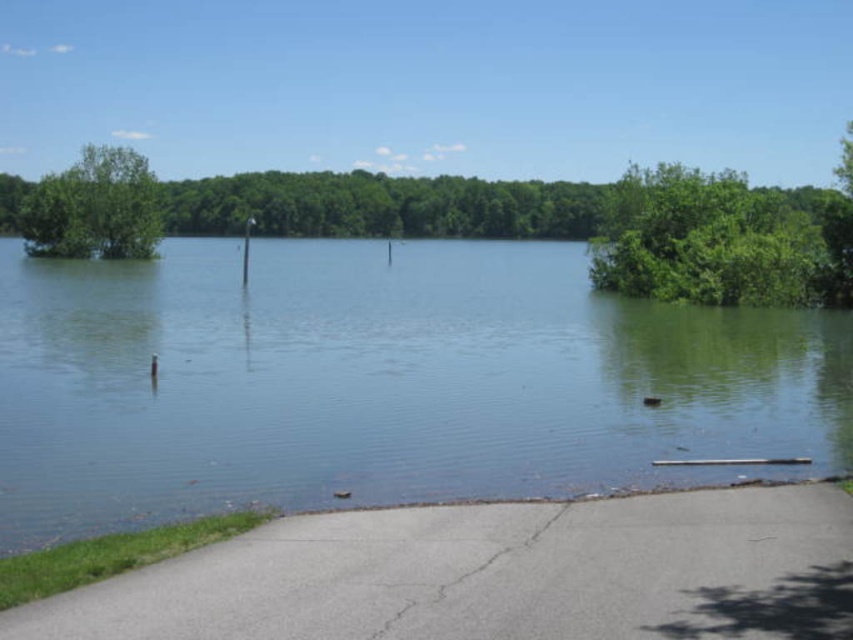
You are navigating a small boat through the flooded area shown in the image. There is a green leafy tree at upper right. Can you determine the direction you should steer to avoid hitting the tree based on its position?

The green leafy tree at upper right is located at point (723, 241), which is in the upper right quadrant of the scene. To avoid hitting the tree, you should steer your boat away from the upper right direction, possibly heading towards the lower left or center areas where there is more open water.

You are a rescue worker trying to navigate through the flooded area. You see the clear water at center and the green leafy tree at upper right. Which object is closer to you as you approach the flooded area?

The clear water at center is closer to the viewer than the green leafy tree at upper right, so the clear water at center would be closer as you approach the flooded area.

You are a rescue worker trying to reach the green leafy tree at upper right from the clear water at center during a flood. The flooded area is too dangerous to walk through. You have a boat that can travel 30 meters. Can you reach the tree without leaving the boat?

The distance between the clear water at center and the green leafy tree at upper right is 32.67 meters. Since the boat can only travel 30 meters, you cannot reach the tree without leaving the boat.